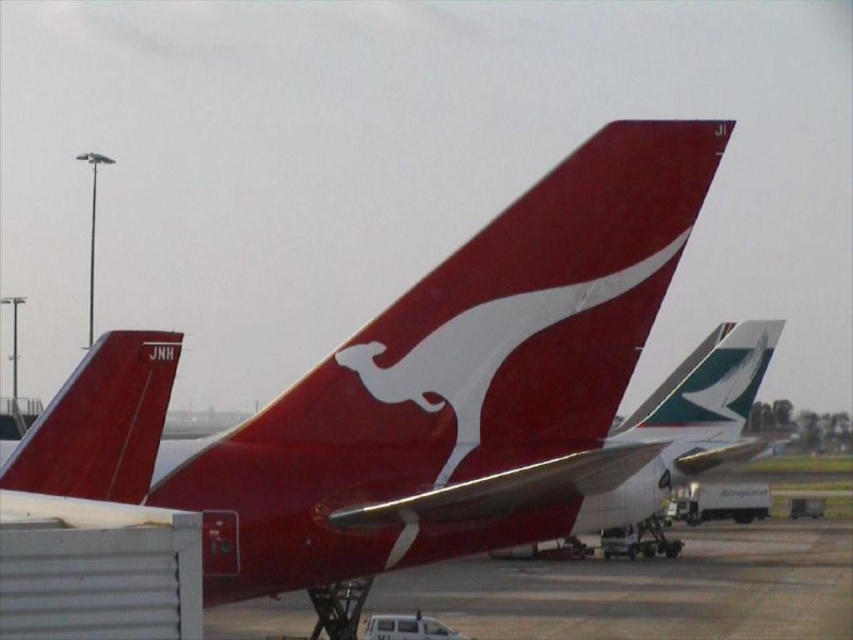
Can you confirm if matte red airplane at center is positioned to the right of matte red tail fin at left?

Yes, matte red airplane at center is to the right of matte red tail fin at left.

Locate an element on the screen. The height and width of the screenshot is (640, 853). matte red airplane at center is located at coordinates (416, 392).

Does point (280, 516) come in front of point (91, 444)?

No, (280, 516) is behind (91, 444).

What are the coordinates of `matte red airplane at center` in the screenshot? It's located at [416, 392].